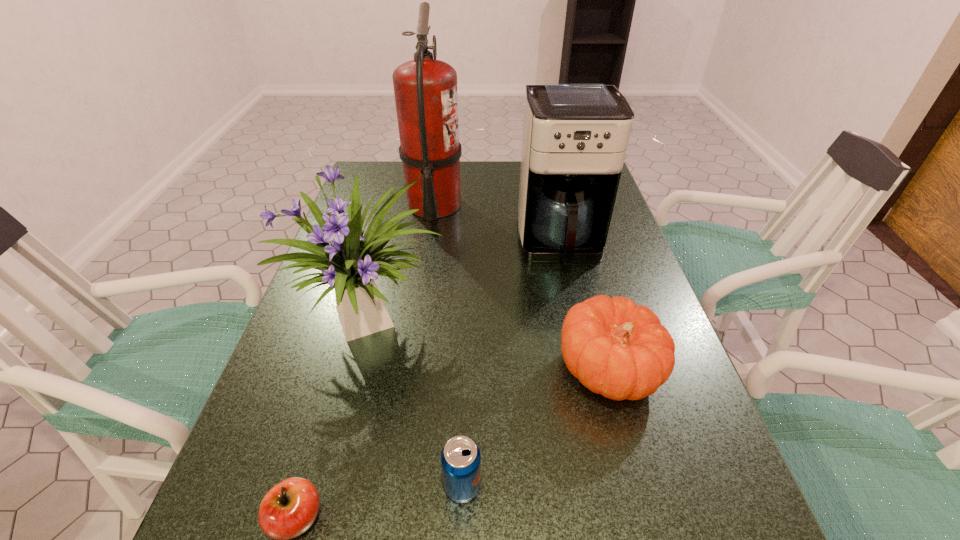
At what (x,y) coordinates should I click in order to perform the action: click on free area in between the tallest object and the pumpkin. Please return your answer as a coordinate pair (x, y). Looking at the image, I should click on (521, 288).

At what (x,y) coordinates should I click in order to perform the action: click on free space between the pumpkin and the fifth tallest object. Please return your answer as a coordinate pair (x, y). This screenshot has width=960, height=540. Looking at the image, I should click on (536, 428).

Where is `empty space that is in between the flower arrangement and the pop soda`? This screenshot has width=960, height=540. empty space that is in between the flower arrangement and the pop soda is located at coordinates (418, 404).

You are a GUI agent. You are given a task and a screenshot of the screen. Output one action in this format:
    pyautogui.click(x=<x>, y=<y>)
    Task: Click on the vacant point located between the tallest object and the second shortest object
    The image size is (960, 540).
    Given the screenshot: What is the action you would take?
    pyautogui.click(x=448, y=346)

You are a GUI agent. You are given a task and a screenshot of the screen. Output one action in this format:
    pyautogui.click(x=<x>, y=<y>)
    Task: Click on the object that ranks as the fifth closest to the fifth tallest object
    
    Given the screenshot: What is the action you would take?
    pyautogui.click(x=425, y=89)

The height and width of the screenshot is (540, 960). I want to click on object identified as the second closest to the second shortest object, so click(x=615, y=348).

Identify the location of free location that satisfies the following two spatial constraints: 1. on the front panel of the pumpkin; 2. on the left side of the coffee maker. The height and width of the screenshot is (540, 960). (588, 370).

Identify the location of vacant point that satisfies the following two spatial constraints: 1. toward the nozzle of the fire extinguisher; 2. on the back side of the pop soda. (394, 486).

At what (x,y) coordinates should I click in order to perform the action: click on vacant region that satisfies the following two spatial constraints: 1. on the front side of the flower arrangement; 2. on the left side of the pumpkin. Please return your answer as a coordinate pair (x, y). Image resolution: width=960 pixels, height=540 pixels. Looking at the image, I should click on (361, 370).

The height and width of the screenshot is (540, 960). What are the coordinates of `free space that satisfies the following two spatial constraints: 1. toward the nozzle of the fire extinguisher; 2. on the front side of the flower arrangement` in the screenshot? It's located at (418, 322).